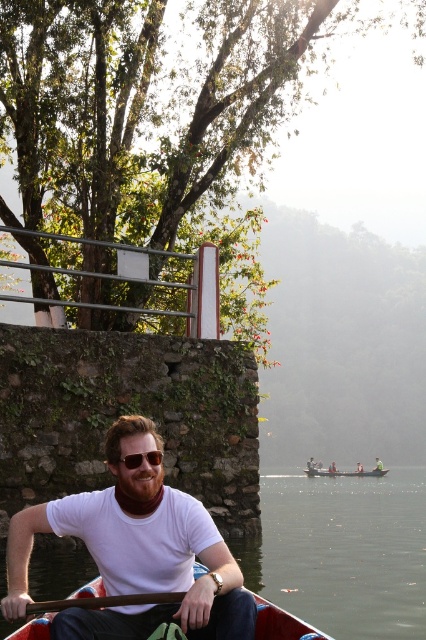
Question: Considering the real-world distances, which object is farthest from the white matte t-shirt at center?

Choices:
 (A) wooden canoe at center
 (B) sunglasses at center

Answer: (A)

Question: Is white matte t-shirt at center positioned behind sunglasses at center?

Choices:
 (A) no
 (B) yes

Answer: (A)

Question: Is white matte t-shirt at center positioned before wooden canoe at center?

Choices:
 (A) no
 (B) yes

Answer: (B)

Question: Which object appears farthest from the camera in this image?

Choices:
 (A) brown wooden paddle at lower center
 (B) white matte t-shirt at center

Answer: (A)

Question: Among these objects, which one is farthest from the camera?

Choices:
 (A) sunglasses at center
 (B) brown wooden paddle at lower center
 (C) wooden canoe at center

Answer: (C)

Question: Where is white matte t-shirt at center located in relation to wooden canoe at center in the image?

Choices:
 (A) left
 (B) right

Answer: (A)